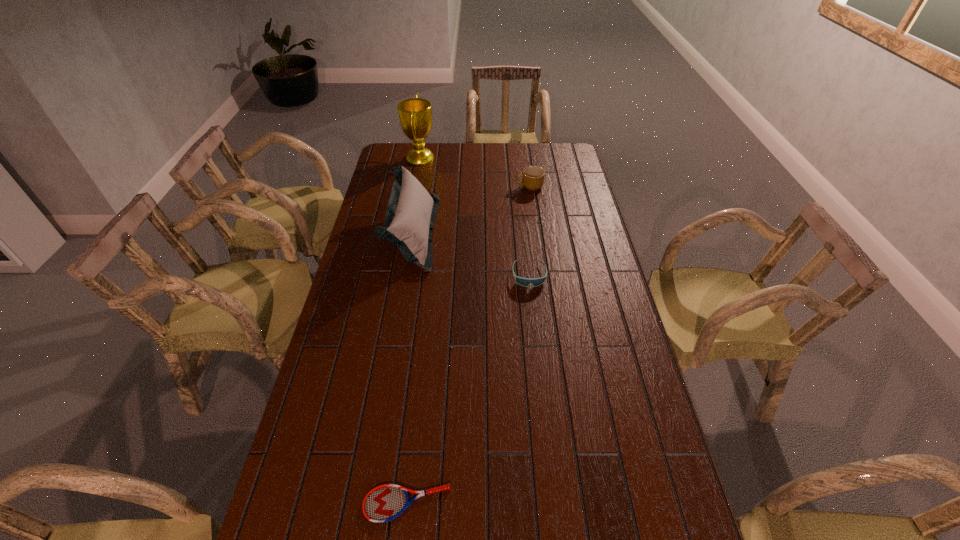
Image resolution: width=960 pixels, height=540 pixels. I want to click on free spot between the cushion and the fourth nearest object, so click(471, 210).

Select which object appears as the third closest to the cushion. Please provide its 2D coordinates. Your answer should be formatted as a tuple, i.e. [(x, y)], where the tuple contains the x and y coordinates of a point satisfying the conditions above.

[(533, 177)]

Choose which object is the third nearest neighbor to the mug. Please provide its 2D coordinates. Your answer should be formatted as a tuple, i.e. [(x, y)], where the tuple contains the x and y coordinates of a point satisfying the conditions above.

[(525, 282)]

Identify the location of vacant region that satisfies the following two spatial constraints: 1. on the shiny surface of the farthest object; 2. on the left side of the tennis racket. This screenshot has height=540, width=960. (355, 504).

The height and width of the screenshot is (540, 960). I want to click on vacant space that satisfies the following two spatial constraints: 1. on the surface of the cushion; 2. on the right side of the shortest object, so click(368, 504).

This screenshot has width=960, height=540. What are the coordinates of `vacant space that satisfies the following two spatial constraints: 1. on the surface of the nearest object; 2. on the right side of the cushion` in the screenshot? It's located at (368, 504).